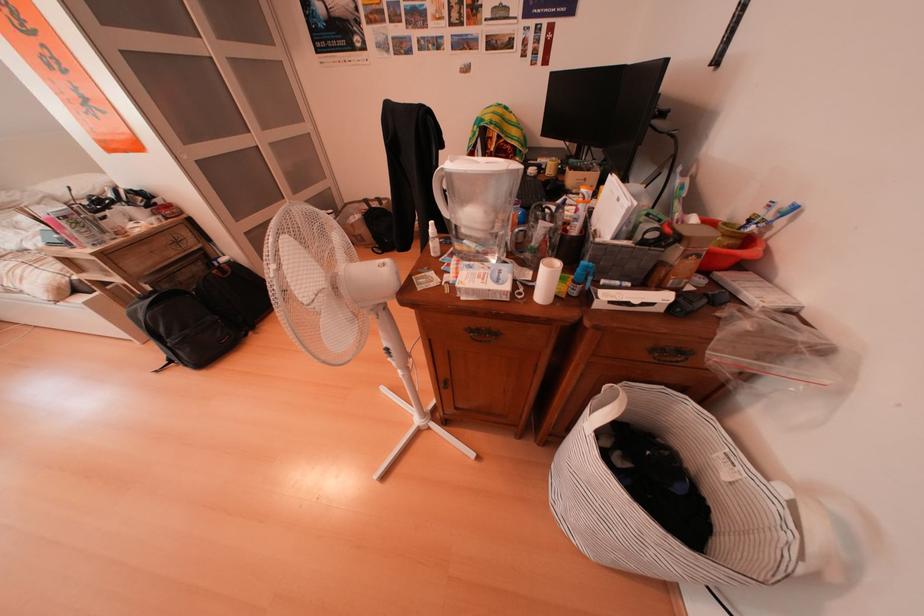
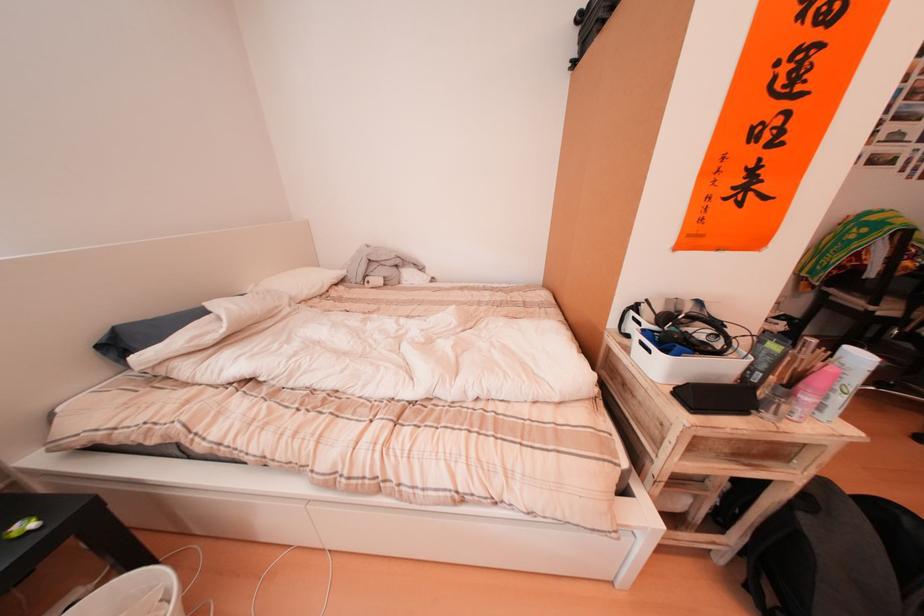
Question: Which direction would the cameraman need to move to produce the second image? Reply with the corresponding letter.

Choices:
 (A) Left
 (B) Right
 (C) Forward
 (D) Backward

Answer: (A)